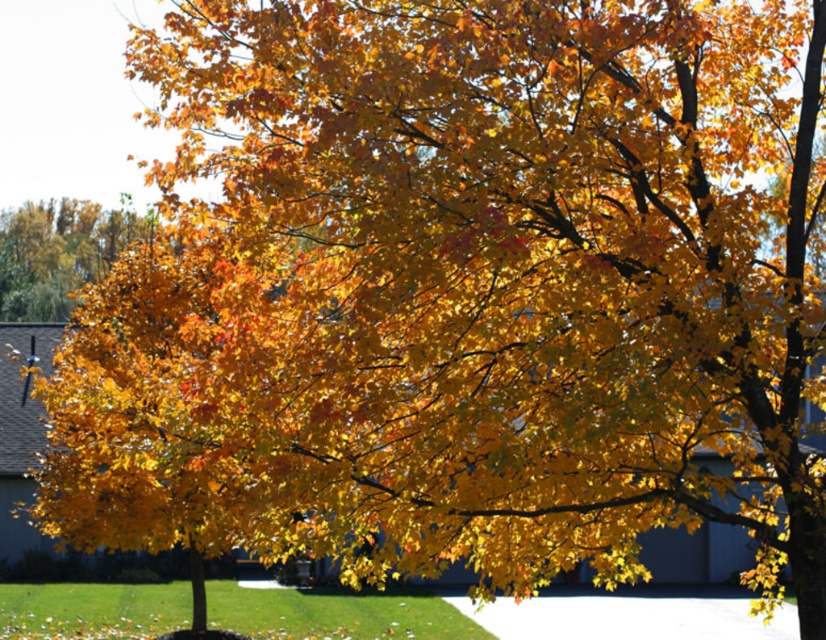
Which is behind, point (554, 634) or point (82, 205)?

Point (82, 205)

Does point (673, 628) come closer to viewer compared to point (51, 230)?

Yes, point (673, 628) is in front of point (51, 230).

The width and height of the screenshot is (826, 640). I want to click on white concrete pavement at lower center, so click(625, 618).

Find the location of a particular element. This screenshot has height=640, width=826. white concrete pavement at lower center is located at coordinates 625,618.